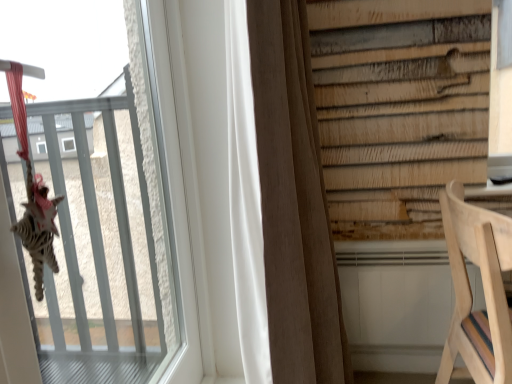
Question: Is brown fabric curtain at center in front of or behind transparent glass window at upper left in the image?

Choices:
 (A) front
 (B) behind

Answer: (B)

Question: From their relative heights in the image, would you say brown fabric curtain at center is taller or shorter than transparent glass window at upper left?

Choices:
 (A) short
 (B) tall

Answer: (B)

Question: Based on their relative distances, which object is nearer to the transparent glass window at upper left?

Choices:
 (A) natural wood chair at lower right
 (B) brown fabric curtain at center

Answer: (B)

Question: Which of these objects is positioned closest to the brown fabric curtain at center?

Choices:
 (A) transparent glass window at upper left
 (B) natural wood chair at lower right

Answer: (B)